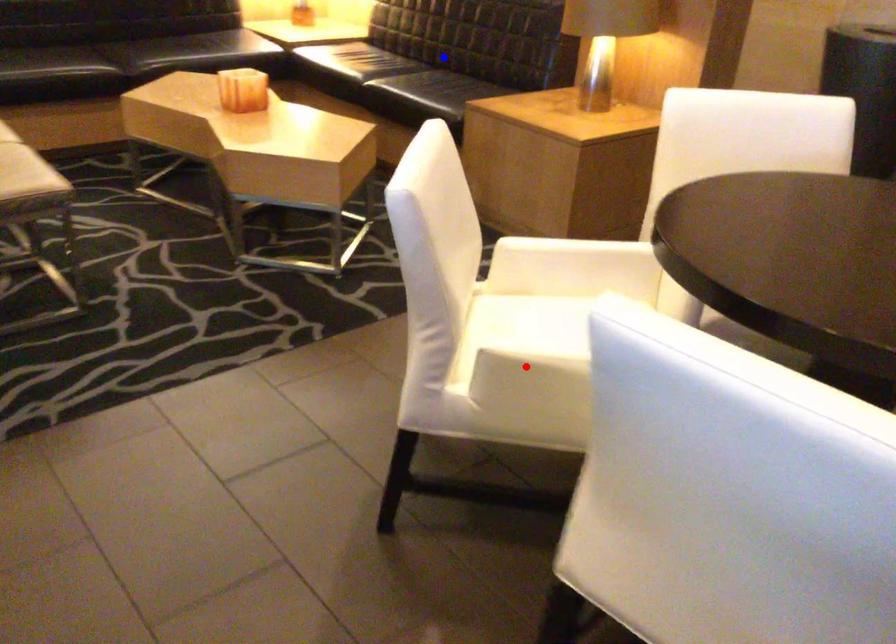
Question: In the image, two points are highlighted. Which point is nearer to the camera? Reply with the corresponding letter.

Choices:
 (A) blue point
 (B) red point

Answer: (B)